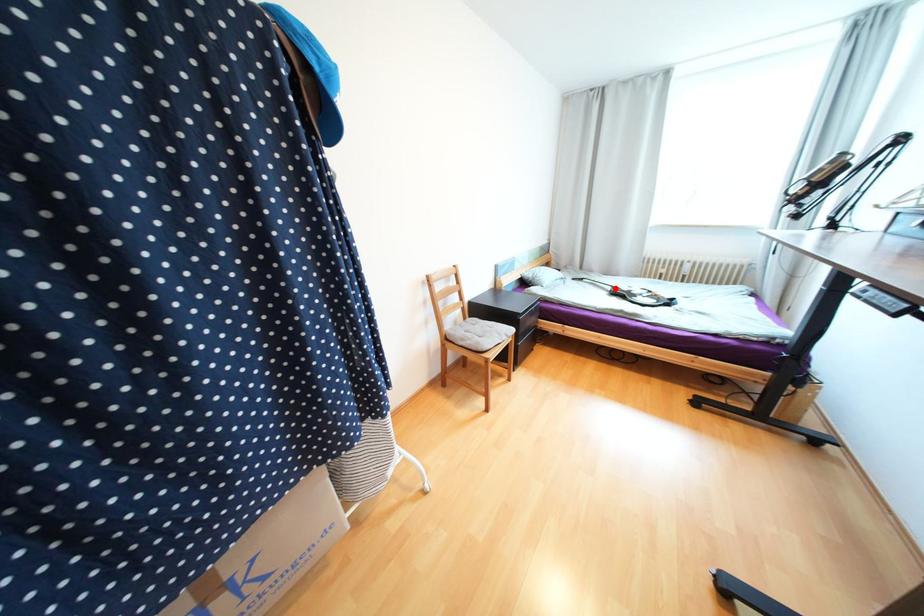
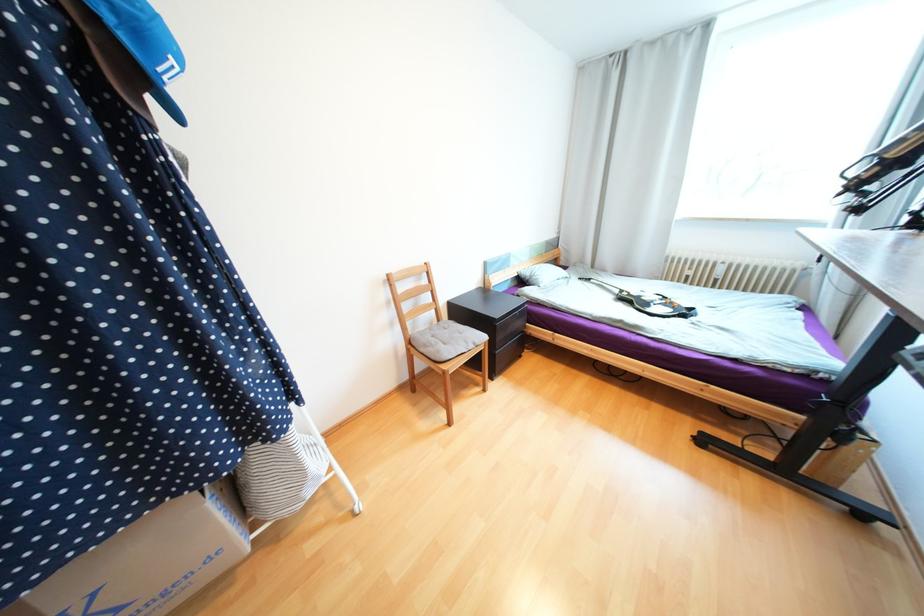
Find the pixel in the second image that matches the highlighted location in the first image.

(623, 292)